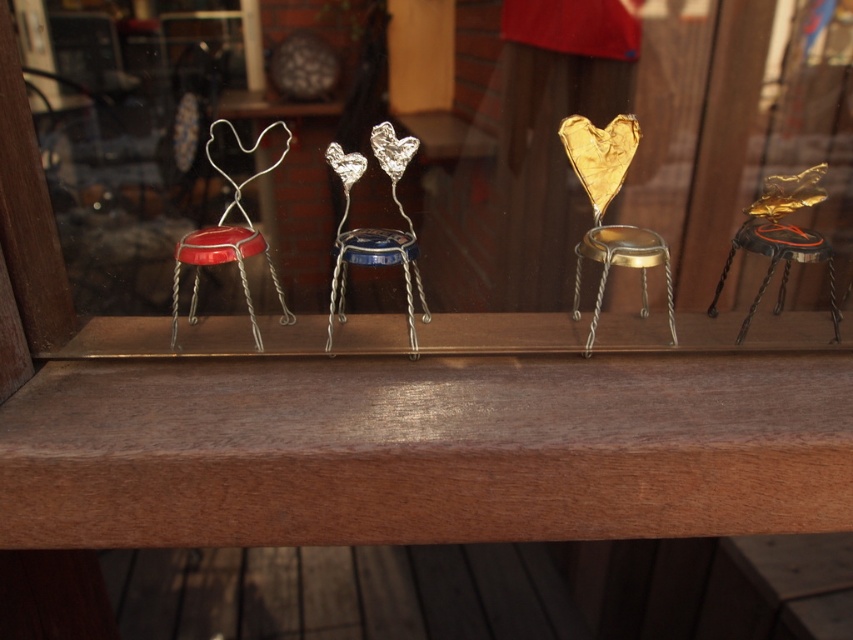
Can you confirm if gold metallic stool at center is positioned above blue metallic stool at center?

Yes.

Does gold metallic stool at center have a smaller size compared to blue metallic stool at center?

No, gold metallic stool at center is not smaller than blue metallic stool at center.

Is point (610, 234) farther from camera compared to point (409, 280)?

Yes, it is.

Where is `gold metallic stool at center`? This screenshot has width=853, height=640. gold metallic stool at center is located at coordinates (621, 266).

Who is more distant from viewer, (395, 104) or (735, 236)?

The point (395, 104) is behind.

Is point (321, 234) more distant than point (755, 250)?

Yes, point (321, 234) is farther from viewer.

This screenshot has height=640, width=853. Find the location of `metallic wire stools at center`. metallic wire stools at center is located at coordinates (703, 122).

Does gold metallic stool at center have a greater width compared to shiny red cap at left?

Incorrect, gold metallic stool at center's width does not surpass shiny red cap at left's.

Is gold metallic stool at center shorter than shiny red cap at left?

No, gold metallic stool at center is not shorter than shiny red cap at left.

Between point (647, 314) and point (212, 252), which one is positioned in front?

Point (212, 252) is in front.

The height and width of the screenshot is (640, 853). What are the coordinates of `gold metallic stool at center` in the screenshot? It's located at coord(621,266).